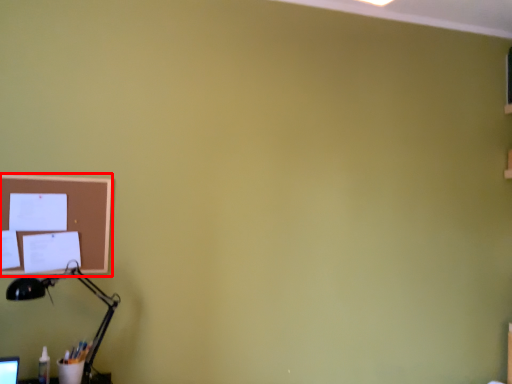
Question: In this image, where is bulletin board (annotated by the red box) located relative to lamp?

Choices:
 (A) left
 (B) right

Answer: (A)